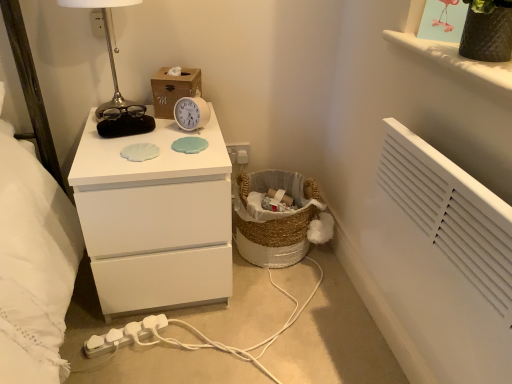
Locate an element on the screen. free space to the left of white plastic extension cord at lower left is located at coordinates (92, 321).